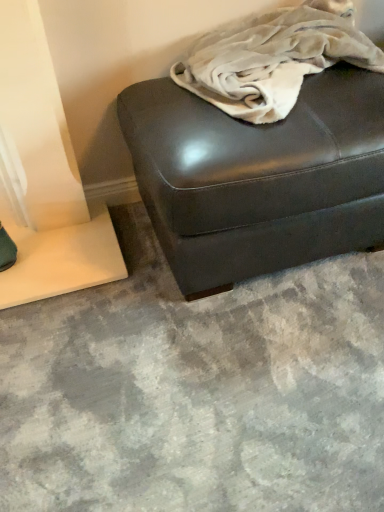
Question: Should I look upward or downward to see white cotton blanket at center?

Choices:
 (A) down
 (B) up

Answer: (B)

Question: Can you confirm if white cotton blanket at center is shorter than shiny dark brown ottoman at center?

Choices:
 (A) yes
 (B) no

Answer: (A)

Question: From a real-world perspective, is white cotton blanket at center located beneath shiny dark brown ottoman at center?

Choices:
 (A) no
 (B) yes

Answer: (A)

Question: Is white cotton blanket at center to the right of shiny dark brown ottoman at center from the viewer's perspective?

Choices:
 (A) yes
 (B) no

Answer: (A)

Question: Can you confirm if white cotton blanket at center is thinner than shiny dark brown ottoman at center?

Choices:
 (A) no
 (B) yes

Answer: (B)

Question: Can you confirm if white cotton blanket at center is taller than shiny dark brown ottoman at center?

Choices:
 (A) yes
 (B) no

Answer: (B)

Question: Is white cotton blanket at center wider than shiny dark brown ottoman at center?

Choices:
 (A) yes
 (B) no

Answer: (B)

Question: Considering the relative sizes of shiny dark brown ottoman at center and white cotton blanket at center in the image provided, is shiny dark brown ottoman at center bigger than white cotton blanket at center?

Choices:
 (A) yes
 (B) no

Answer: (A)

Question: Is the depth of shiny dark brown ottoman at center greater than that of white cotton blanket at center?

Choices:
 (A) yes
 (B) no

Answer: (A)

Question: From the image's perspective, would you say shiny dark brown ottoman at center is positioned over white cotton blanket at center?

Choices:
 (A) yes
 (B) no

Answer: (B)

Question: Is there a large distance between shiny dark brown ottoman at center and white cotton blanket at center?

Choices:
 (A) no
 (B) yes

Answer: (A)

Question: Is shiny dark brown ottoman at center wider than white cotton blanket at center?

Choices:
 (A) no
 (B) yes

Answer: (B)

Question: Is shiny dark brown ottoman at center outside of white cotton blanket at center?

Choices:
 (A) yes
 (B) no

Answer: (A)

Question: Visually, is white cotton blanket at center positioned to the left or to the right of shiny dark brown ottoman at center?

Choices:
 (A) left
 (B) right

Answer: (B)